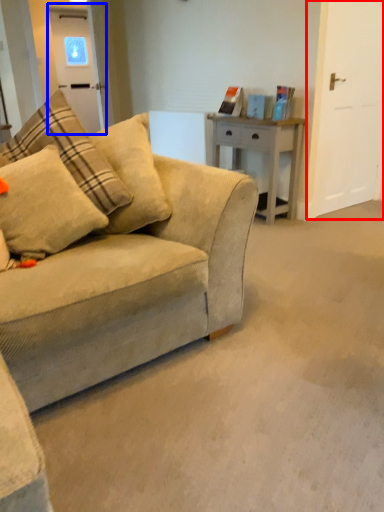
Question: Among these objects, which one is nearest to the camera, glass door (highlighted by a red box) or glass door (highlighted by a blue box)?

Choices:
 (A) glass door
 (B) glass door

Answer: (A)